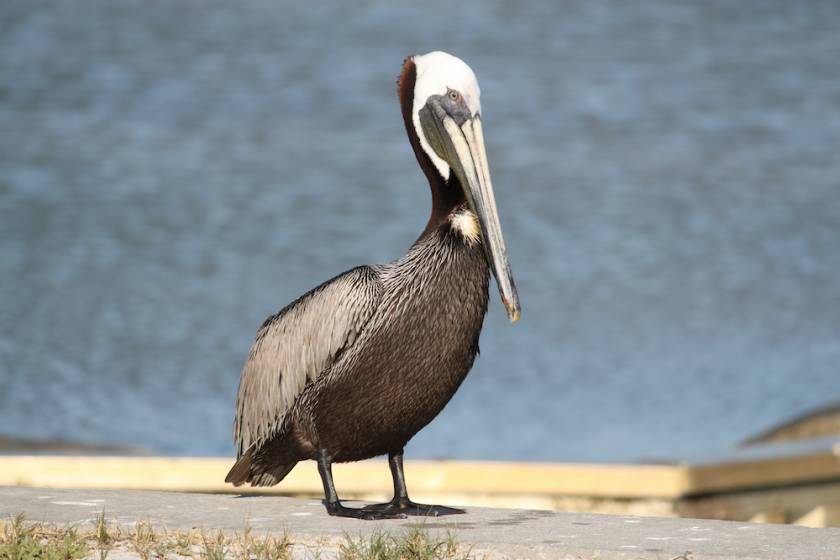
This screenshot has height=560, width=840. I want to click on wall, so click(x=737, y=494).